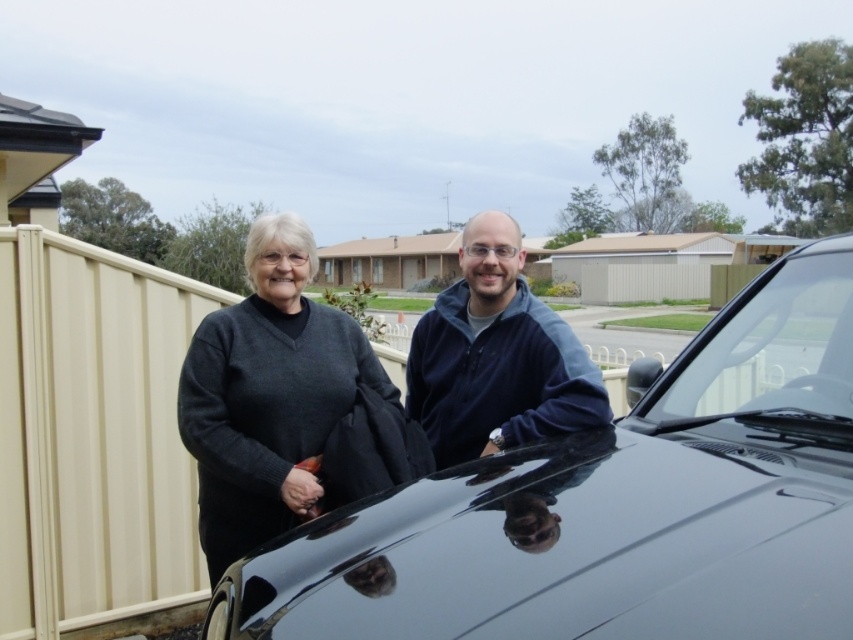
Question: Is glossy black car at center wider than blue fleece jacket at center?

Choices:
 (A) yes
 (B) no

Answer: (A)

Question: Does glossy black car at center lie behind clear glass windshield at upper center?

Choices:
 (A) yes
 (B) no

Answer: (B)

Question: Which point is closer to the camera taking this photo?

Choices:
 (A) (811, 259)
 (B) (456, 282)
 (C) (271, 355)

Answer: (A)

Question: Among these points, which one is nearest to the camera?

Choices:
 (A) (187, 432)
 (B) (454, 525)

Answer: (B)

Question: Among these objects, which one is farthest from the camera?

Choices:
 (A) glossy black car at center
 (B) clear glass windshield at upper center
 (C) blue fleece jacket at center
 (D) dark gray sweater at left

Answer: (C)

Question: Is glossy black car at center smaller than blue fleece jacket at center?

Choices:
 (A) yes
 (B) no

Answer: (B)